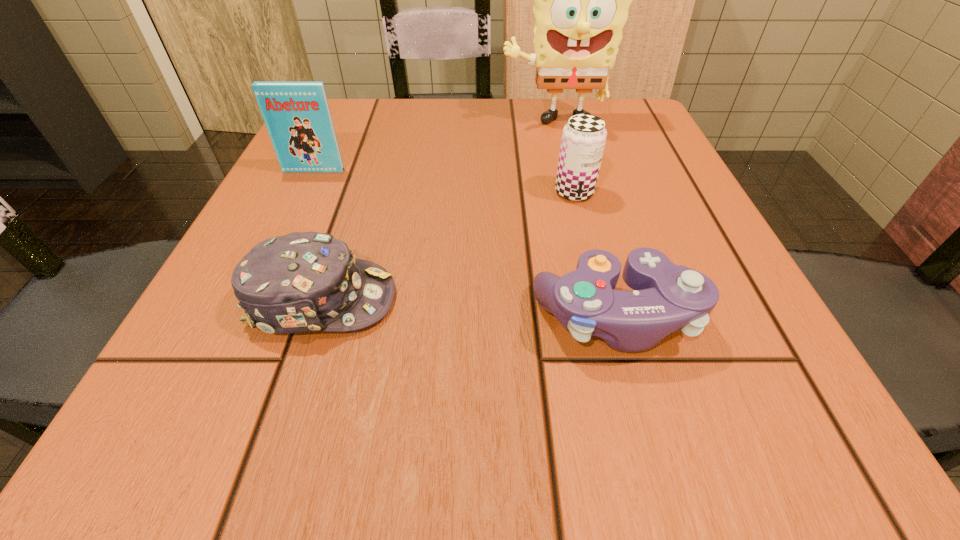
Where is `vacant space located on the left of the third tallest object`? This screenshot has width=960, height=540. vacant space located on the left of the third tallest object is located at coordinates pos(497,192).

Locate an element on the screen. Image resolution: width=960 pixels, height=540 pixels. free location located 0.230m on the back of the control is located at coordinates (579, 185).

Where is `free space located on the front-facing side of the headwear`? The width and height of the screenshot is (960, 540). free space located on the front-facing side of the headwear is located at coordinates (476, 300).

Find the location of a particular element. The height and width of the screenshot is (540, 960). object present at the far edge is located at coordinates (582, 0).

Locate an element on the screen. book that is at the left edge is located at coordinates (297, 116).

At what (x,y) coordinates should I click in order to perform the action: click on headwear that is positioned at the left edge. Please return your answer as a coordinate pair (x, y). The width and height of the screenshot is (960, 540). Looking at the image, I should click on (300, 282).

Where is `sponge that is positioned at the right edge`? This screenshot has height=540, width=960. sponge that is positioned at the right edge is located at coordinates (582, 0).

At what (x,y) coordinates should I click in order to perform the action: click on control present at the right edge. Please return your answer as a coordinate pair (x, y). Looking at the image, I should click on coord(667,297).

The height and width of the screenshot is (540, 960). In order to click on object that is positioned at the far right corner in this screenshot , I will do `click(582, 0)`.

The width and height of the screenshot is (960, 540). Identify the location of vacant region at the far edge of the desktop. [x=420, y=126].